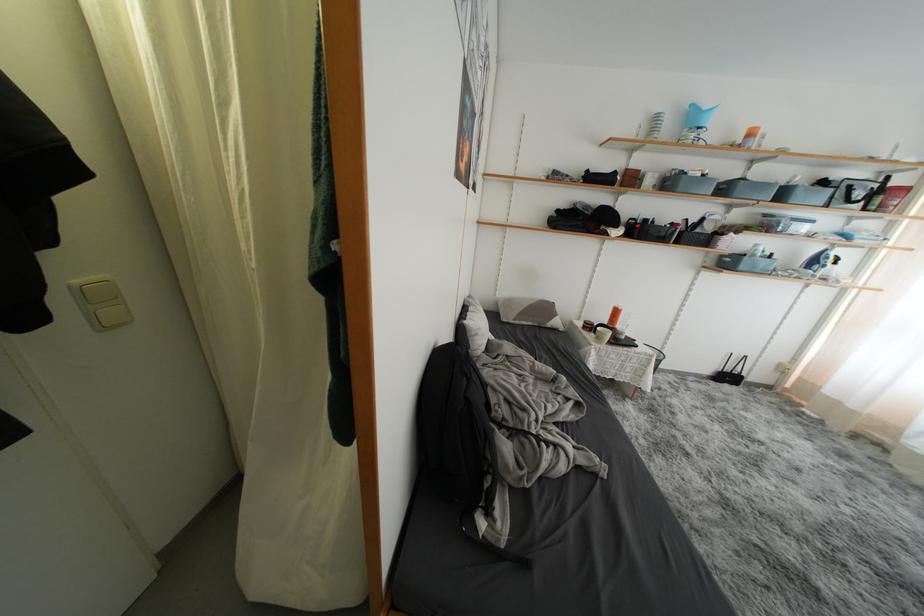
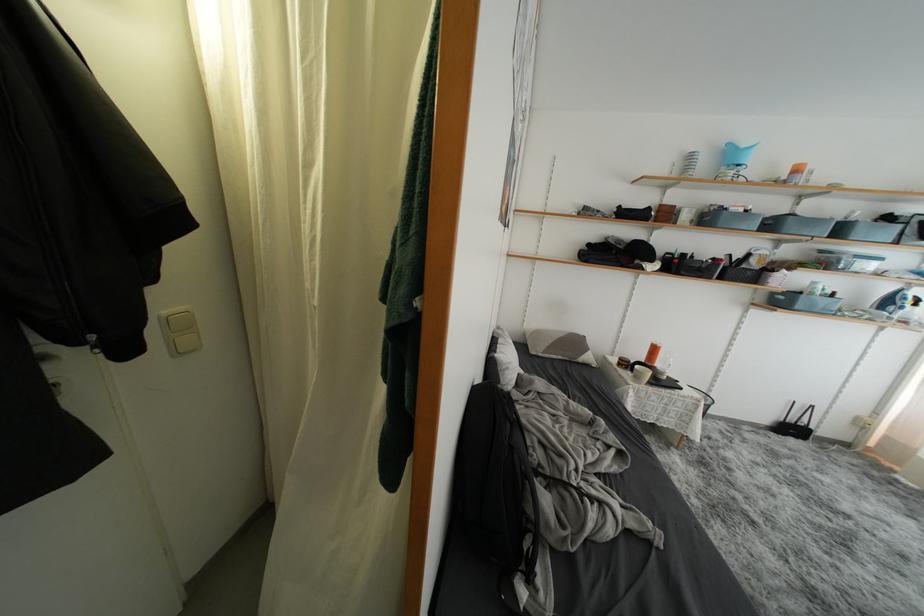
Find the pixel in the second image that matches point 663,180 in the first image.

(700, 215)